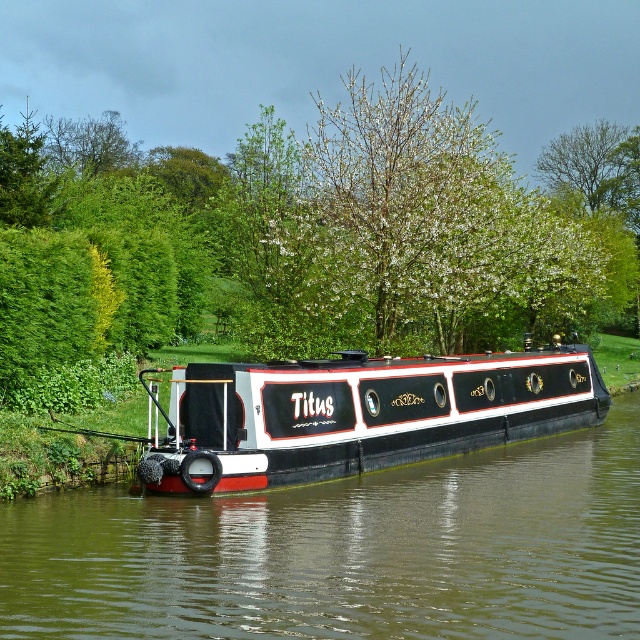
Question: Does black polished wood barge at center appear under green leafy tree at upper center?

Choices:
 (A) yes
 (B) no

Answer: (A)

Question: Can you confirm if green leafy tree at center is positioned below green leafy tree at upper center?

Choices:
 (A) yes
 (B) no

Answer: (A)

Question: Based on their relative distances, which object is farther from the black glossy boat at center?

Choices:
 (A) green leafy tree at center
 (B) green leafy tree at upper center

Answer: (B)

Question: Is black polished wood barge at center to the left of green leafy tree at upper center from the viewer's perspective?

Choices:
 (A) yes
 (B) no

Answer: (A)

Question: Which point appears farthest from the camera in this image?

Choices:
 (A) (504, 604)
 (B) (330, 186)

Answer: (B)

Question: Estimate the real-world distances between objects in this image. Which object is closer to the black glossy boat at center?

Choices:
 (A) black polished wood barge at center
 (B) green leafy tree at upper center
 (C) green leafy tree at center

Answer: (A)